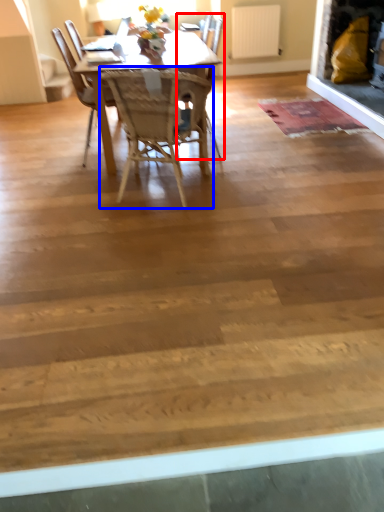
Question: Which point is further to the camera, chair (highlighted by a red box) or chair (highlighted by a blue box)?

Choices:
 (A) chair
 (B) chair

Answer: (A)